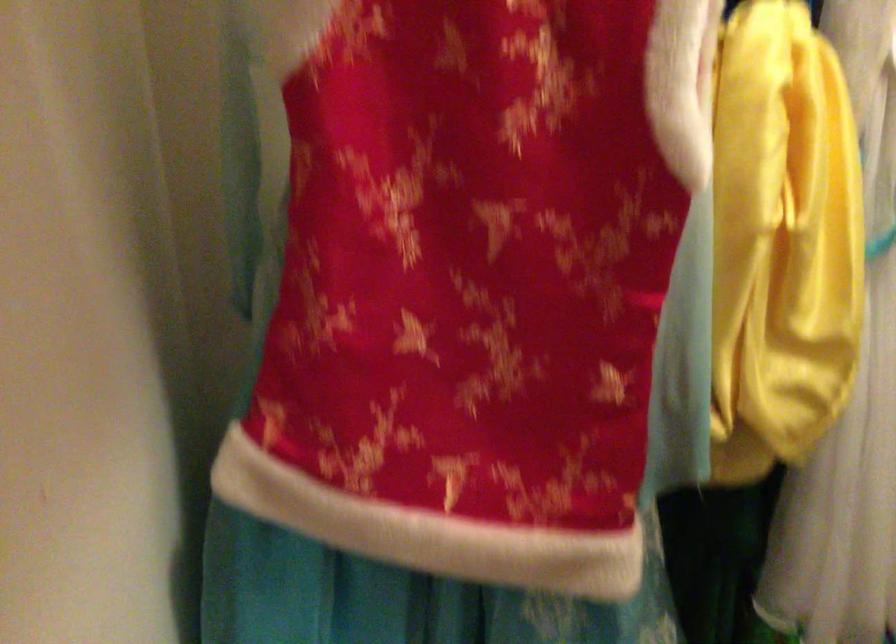
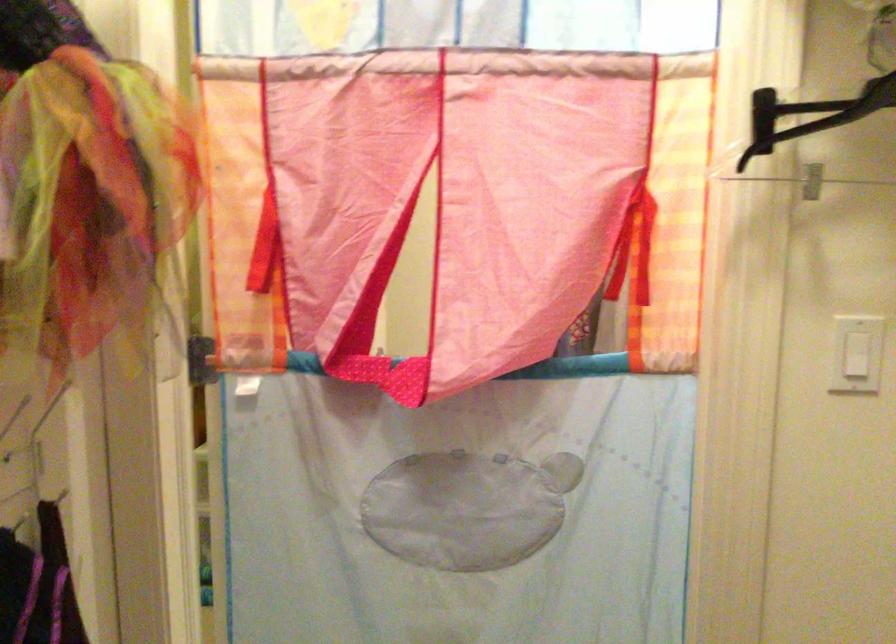
Question: The camera is either moving clockwise (left) or counter-clockwise (right) around the object. The first image is from the beginning of the video and the second image is from the end. Is the camera moving left or right when shooting the video?

Choices:
 (A) Left
 (B) Right

Answer: (A)